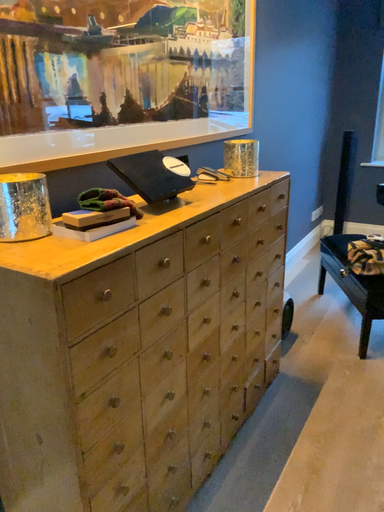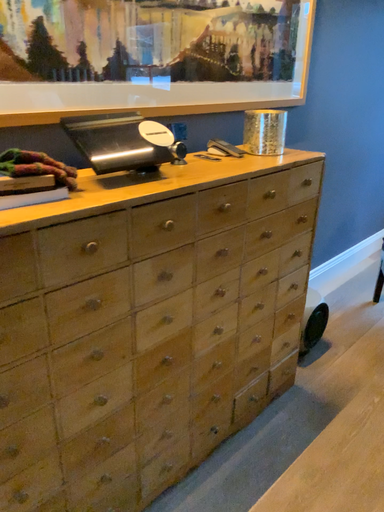
Question: Which way did the camera rotate in the video?

Choices:
 (A) rotated left
 (B) rotated right

Answer: (A)